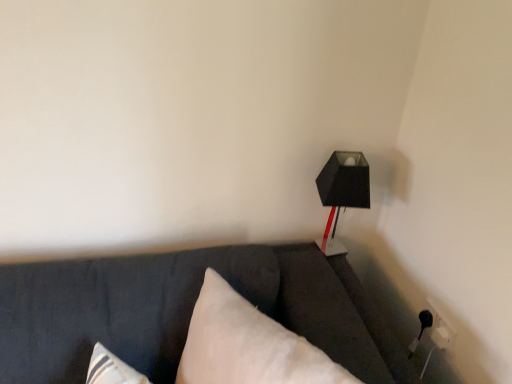
Question: Does white soft pillow at center appear on the left side of black matte lamp at upper right?

Choices:
 (A) no
 (B) yes

Answer: (B)

Question: Is there a large distance between white soft pillow at center and black matte lamp at upper right?

Choices:
 (A) no
 (B) yes

Answer: (A)

Question: From the image's perspective, is white soft pillow at center located above black matte lamp at upper right?

Choices:
 (A) yes
 (B) no

Answer: (B)

Question: Can you see white soft pillow at center touching black matte lamp at upper right?

Choices:
 (A) no
 (B) yes

Answer: (A)

Question: Is white soft pillow at center outside of black matte lamp at upper right?

Choices:
 (A) yes
 (B) no

Answer: (A)

Question: Considering the relative sizes of white soft pillow at center and black matte lamp at upper right in the image provided, is white soft pillow at center thinner than black matte lamp at upper right?

Choices:
 (A) no
 (B) yes

Answer: (A)

Question: Is black matte lamp at upper right thinner than white soft pillow at center?

Choices:
 (A) yes
 (B) no

Answer: (A)

Question: From the image's perspective, is black matte lamp at upper right beneath white soft pillow at center?

Choices:
 (A) no
 (B) yes

Answer: (A)

Question: Is the depth of black matte lamp at upper right greater than that of white soft pillow at center?

Choices:
 (A) yes
 (B) no

Answer: (A)

Question: Does black matte lamp at upper right have a greater width compared to white soft pillow at center?

Choices:
 (A) yes
 (B) no

Answer: (B)

Question: Is black matte lamp at upper right taller than white soft pillow at center?

Choices:
 (A) no
 (B) yes

Answer: (A)

Question: Is black matte lamp at upper right in contact with white soft pillow at center?

Choices:
 (A) yes
 (B) no

Answer: (B)

Question: From their relative heights in the image, would you say black matte lamp at upper right is taller or shorter than white soft pillow at center?

Choices:
 (A) tall
 (B) short

Answer: (B)